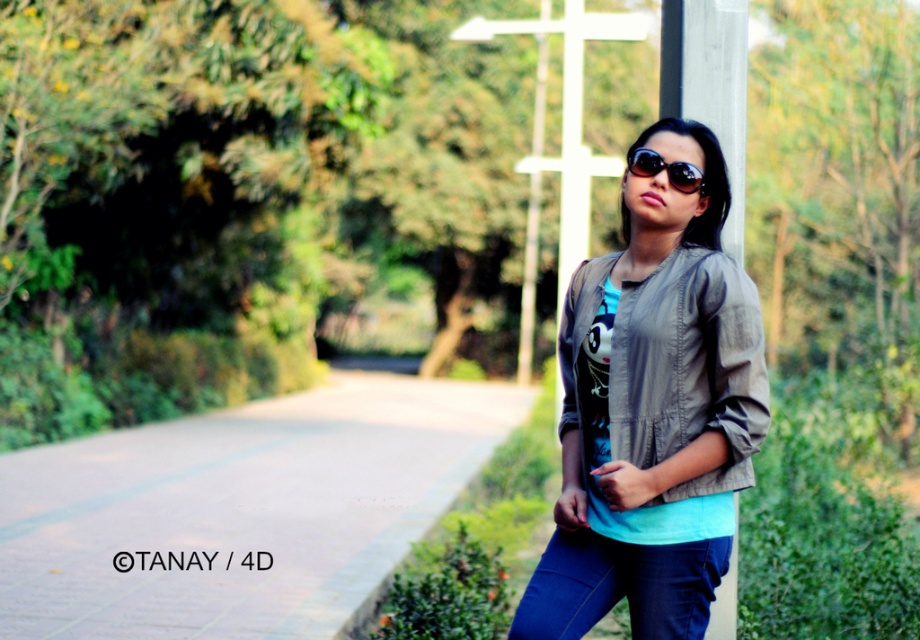
Who is positioned more to the right, paved concrete at center or gray wood pole at center?

Positioned to the right is gray wood pole at center.

Can you confirm if paved concrete at center is positioned above gray wood pole at center?

Incorrect, paved concrete at center is not positioned above gray wood pole at center.

Between point (136, 515) and point (726, 624), which one is positioned behind?

Positioned behind is point (136, 515).

You are a GUI agent. You are given a task and a screenshot of the screen. Output one action in this format:
    pyautogui.click(x=<x>, y=<y>)
    Task: Click on the paved concrete at center
    
    Given the screenshot: What is the action you would take?
    240,509

Is point (713, 29) in front of point (582, 163)?

Yes, it is in front of point (582, 163).

Is gray wood pole at center below white wooden cross at center?

Indeed, gray wood pole at center is positioned under white wooden cross at center.

Image resolution: width=920 pixels, height=640 pixels. Find the location of `gray wood pole at center`. gray wood pole at center is located at coordinates (709, 84).

Is white wooden cross at center shorter than sunglasses at center?

No.

Can you confirm if white wooden cross at center is positioned above sunglasses at center?

Yes.

Between point (577, 68) and point (656, 172), which one is positioned in front?

Point (656, 172)

Identify the location of white wooden cross at center. (567, 116).